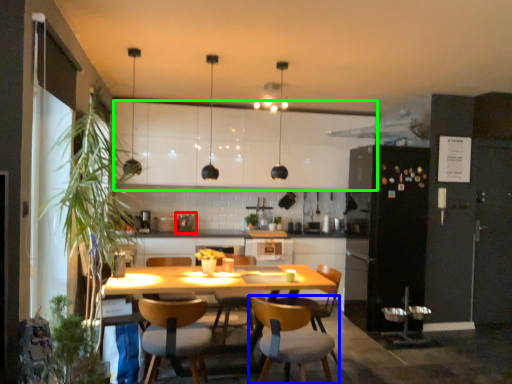
Question: Estimate the real-world distances between objects in this image. Which object is closer to appliance (highlighted by a red box), chair (highlighted by a blue box) or cabinetry (highlighted by a green box)?

Choices:
 (A) chair
 (B) cabinetry

Answer: (B)